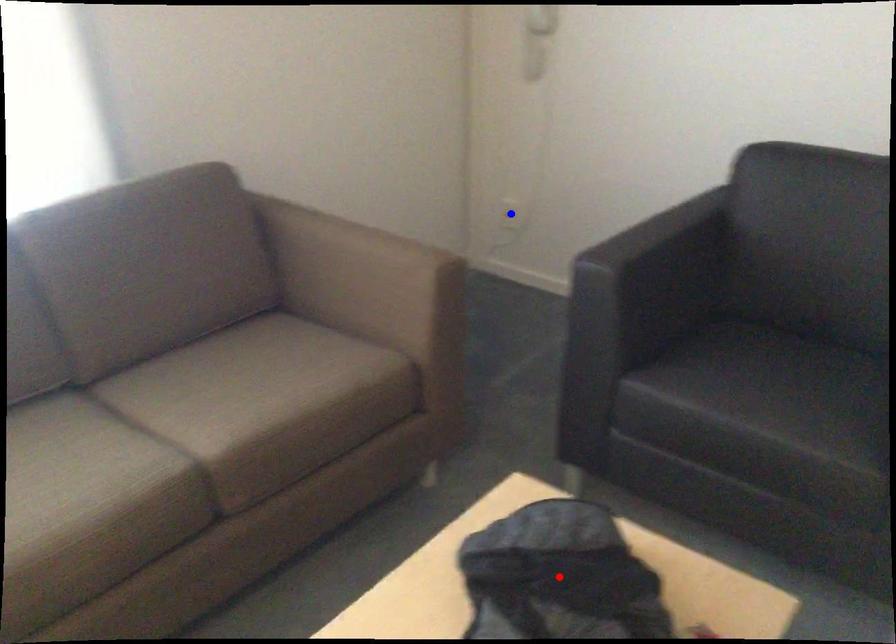
Question: Two points are marked on the image. Which point is closer to the camera?

Choices:
 (A) Blue point is closer.
 (B) Red point is closer.

Answer: (B)